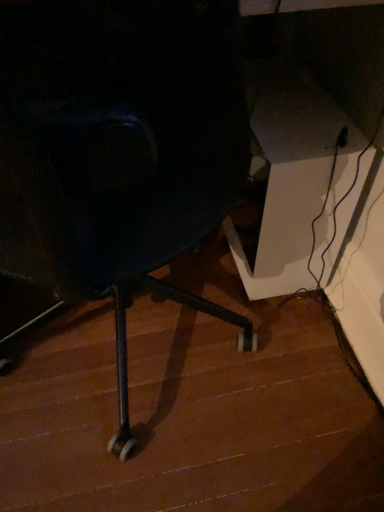
Question: From the image's perspective, is white glossy table at right on top of matte black chair at center?

Choices:
 (A) no
 (B) yes

Answer: (B)

Question: Is white glossy table at right shorter than matte black chair at center?

Choices:
 (A) yes
 (B) no

Answer: (B)

Question: Considering the relative positions of white glossy table at right and matte black chair at center in the image provided, is white glossy table at right to the right of matte black chair at center from the viewer's perspective?

Choices:
 (A) yes
 (B) no

Answer: (A)

Question: Does white glossy table at right touch matte black chair at center?

Choices:
 (A) yes
 (B) no

Answer: (B)

Question: From the image's perspective, is white glossy table at right beneath matte black chair at center?

Choices:
 (A) yes
 (B) no

Answer: (B)

Question: Is white glossy table at right looking in the opposite direction of matte black chair at center?

Choices:
 (A) no
 (B) yes

Answer: (A)

Question: Is matte black chair at center to the left of white glossy table at right from the viewer's perspective?

Choices:
 (A) yes
 (B) no

Answer: (A)

Question: Does matte black chair at center lie in front of white glossy table at right?

Choices:
 (A) no
 (B) yes

Answer: (B)

Question: From the image's perspective, is matte black chair at center under white glossy table at right?

Choices:
 (A) yes
 (B) no

Answer: (A)

Question: Is matte black chair at center located outside white glossy table at right?

Choices:
 (A) no
 (B) yes

Answer: (B)

Question: Does matte black chair at center have a lesser height compared to white glossy table at right?

Choices:
 (A) no
 (B) yes

Answer: (B)

Question: Is matte black chair at center to the right of white glossy table at right from the viewer's perspective?

Choices:
 (A) yes
 (B) no

Answer: (B)

Question: Considering the relative positions of white glossy table at right and matte black chair at center in the image provided, is white glossy table at right to the left or to the right of matte black chair at center?

Choices:
 (A) left
 (B) right

Answer: (B)